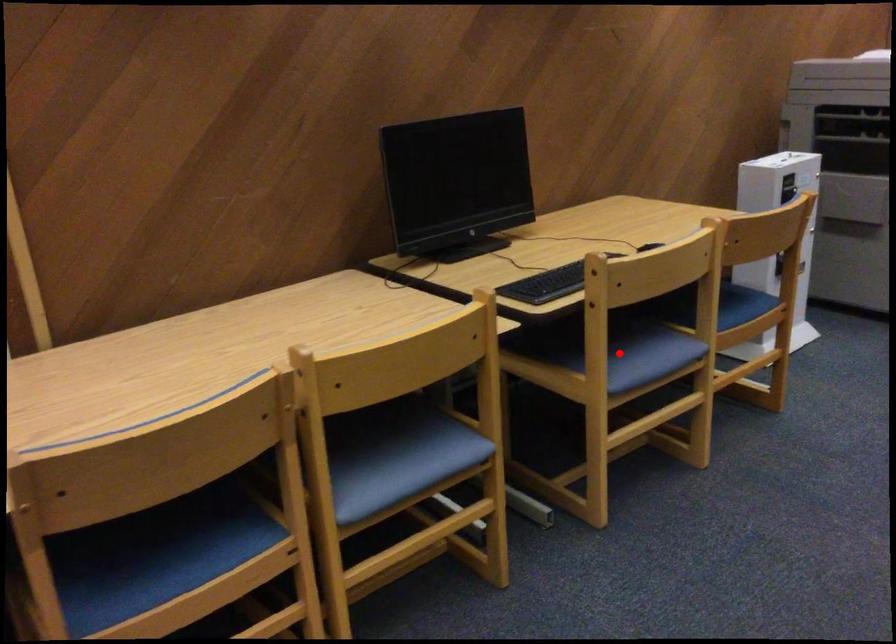
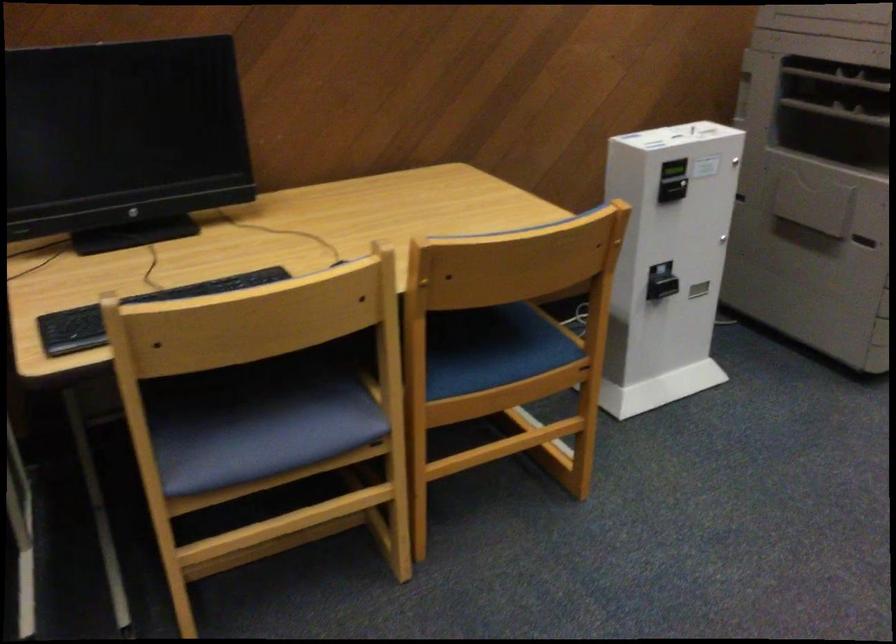
Locate, in the second image, the point that corresponds to the highlighted location in the first image.

(255, 422)